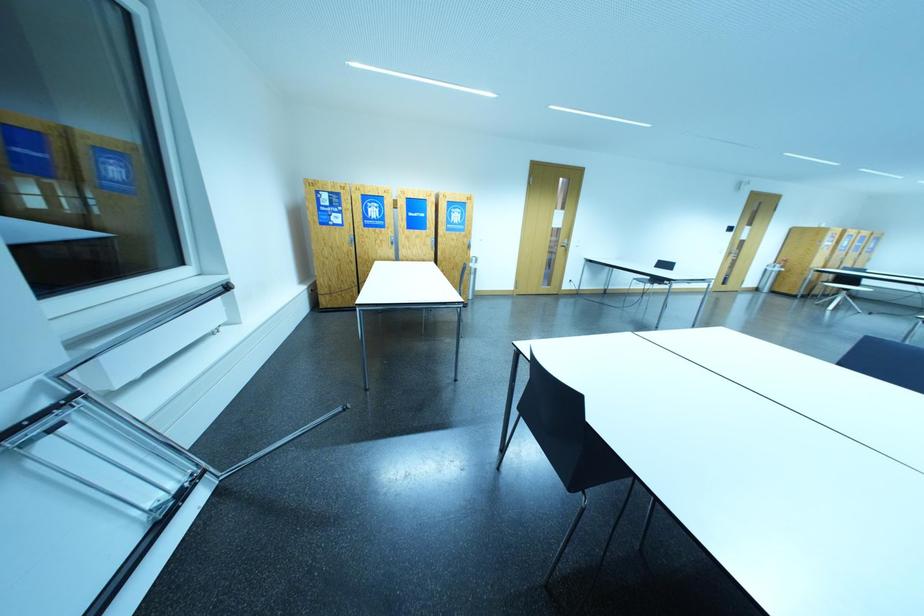
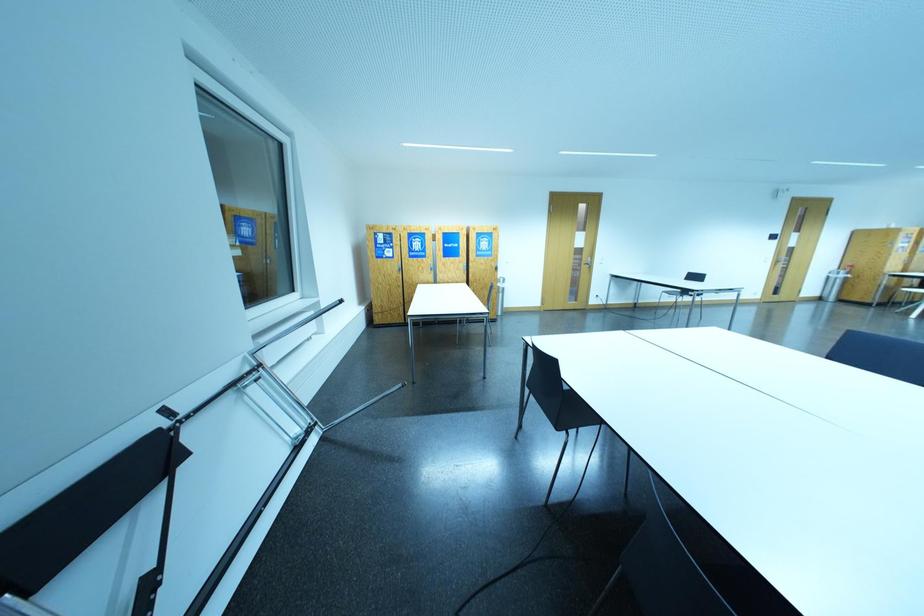
Question: How did the camera likely rotate?

Choices:
 (A) Left
 (B) Right
 (C) Up
 (D) Down

Answer: (A)